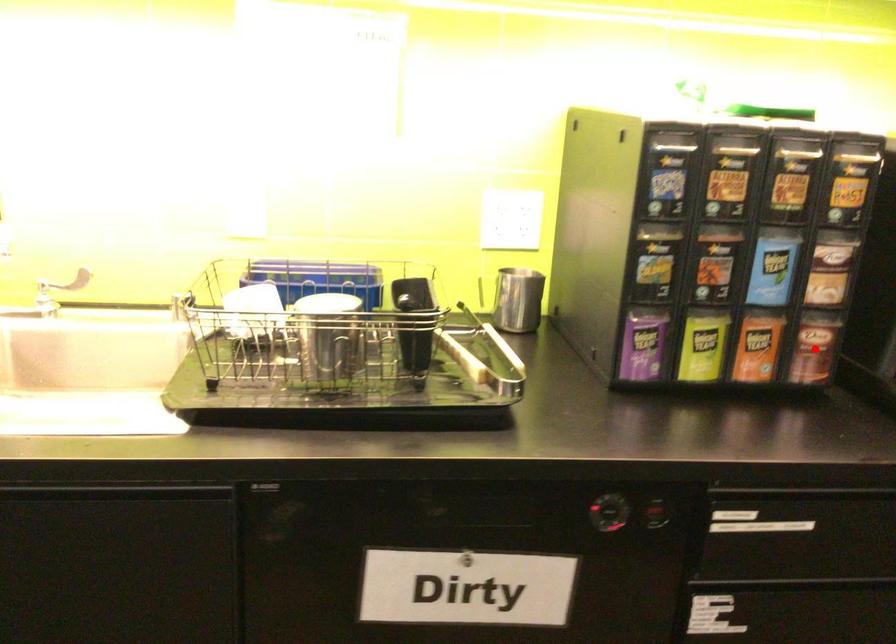
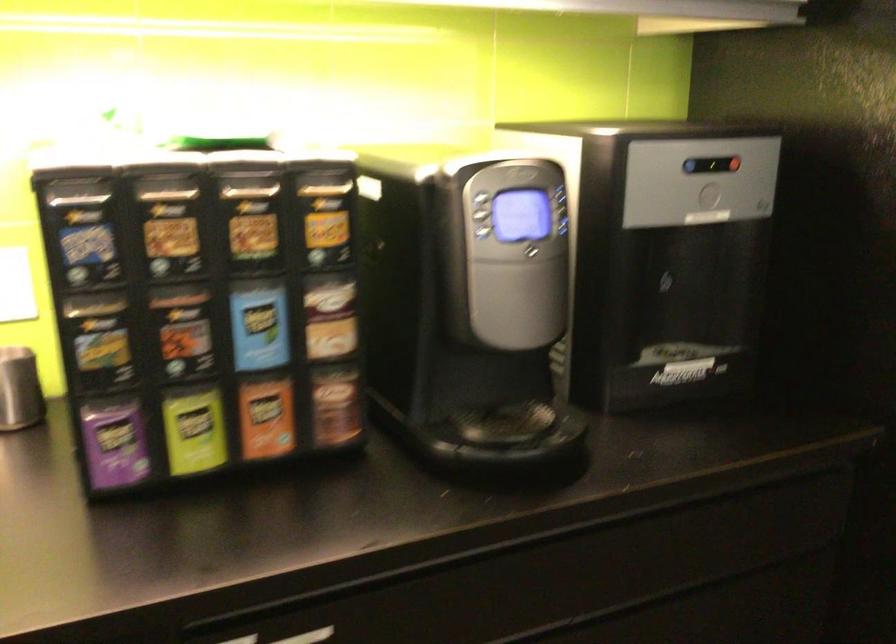
Where in the second image is the point corresponding to the highlighted location from the first image?

(336, 406)